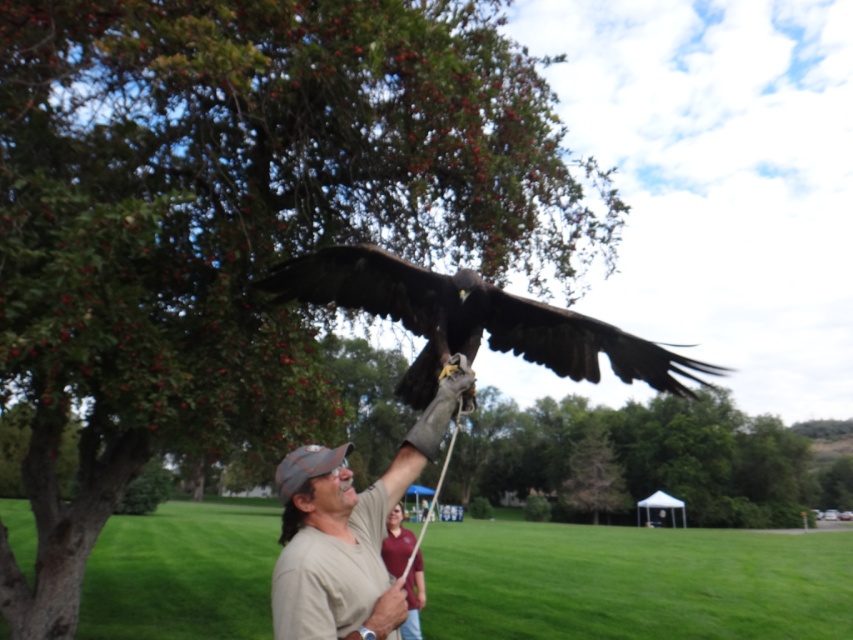
You are a photographer trying to capture a clear photo of the tan cotton shirt at center and the beige cotton shirt at center. Which shirt should you focus on first to ensure it appears sharp in the photo?

You should focus on the tan cotton shirt at center first because it is closer to the viewer than the beige cotton shirt at center, so focusing on the closer object ensures sharpness.

You are standing in the park scene and want to place a small flag exactly halfway between point [131,326] and point [396,577]. Which direction should you move from the first point to reach the halfway point?

To reach the halfway point between point [131,326] and point [396,577], you should move towards the direction of point [396,577]. The halfway point would be at coordinates approximately 0.7065, 0.3095.